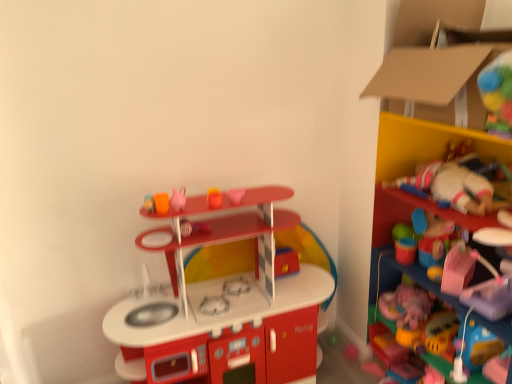
Question: Is cardboard at upper right bigger than matte pink teapot at upper center, positioned as the fifth toy in bottom-to-top order?

Choices:
 (A) no
 (B) yes

Answer: (B)

Question: Considering the relative sizes of cardboard at upper right and matte pink teapot at upper center, positioned as the fifth toy in bottom-to-top order, in the image provided, is cardboard at upper right wider than matte pink teapot at upper center, positioned as the fifth toy in bottom-to-top order,?

Choices:
 (A) no
 (B) yes

Answer: (B)

Question: Are cardboard at upper right and matte pink teapot at upper center, arranged as the 2th toy when viewed from the top, far apart?

Choices:
 (A) yes
 (B) no

Answer: (A)

Question: Is cardboard at upper right smaller than matte pink teapot at upper center, positioned as the fifth toy in bottom-to-top order?

Choices:
 (A) no
 (B) yes

Answer: (A)

Question: Is cardboard at upper right next to matte pink teapot at upper center, arranged as the 2th toy when viewed from the top?

Choices:
 (A) yes
 (B) no

Answer: (B)

Question: From the image's perspective, is plush fabric stuffed animal at right, which is the first shelf in top-to-bottom order, located above or below smooth plastic cup at upper center, which is the 4th toy in bottom-to-top order?

Choices:
 (A) above
 (B) below

Answer: (B)

Question: Considering the positions of plush fabric stuffed animal at right, marked as the 2th shelf in a bottom-to-top arrangement, and smooth plastic cup at upper center, marked as the third toy in a top-to-bottom arrangement, in the image, is plush fabric stuffed animal at right, marked as the 2th shelf in a bottom-to-top arrangement, bigger or smaller than smooth plastic cup at upper center, marked as the third toy in a top-to-bottom arrangement,?

Choices:
 (A) big
 (B) small

Answer: (A)

Question: From a real-world perspective, is plush fabric stuffed animal at right, which is the first shelf in top-to-bottom order, positioned above or below smooth plastic cup at upper center, marked as the third toy in a top-to-bottom arrangement?

Choices:
 (A) below
 (B) above

Answer: (A)

Question: Considering their positions, is plush fabric stuffed animal at right, marked as the 2th shelf in a bottom-to-top arrangement, located in front of or behind smooth plastic cup at upper center, which is the 4th toy in bottom-to-top order?

Choices:
 (A) behind
 (B) front

Answer: (B)

Question: Is pink matte heart at upper center, the 6th toy ordered from the bottom, in front of or behind matte plastic cup at center, which ranks as the 4th toy in top-to-bottom order, in the image?

Choices:
 (A) behind
 (B) front

Answer: (B)

Question: Based on their sizes in the image, would you say pink matte heart at upper center, the 6th toy ordered from the bottom, is bigger or smaller than matte plastic cup at center, the third toy from the bottom?

Choices:
 (A) small
 (B) big

Answer: (A)

Question: Does point (244, 188) appear closer or farther from the camera than point (181, 230)?

Choices:
 (A) closer
 (B) farther

Answer: (B)

Question: From a real-world perspective, relative to matte plastic cup at center, which ranks as the 4th toy in top-to-bottom order, is pink matte heart at upper center, the 6th toy ordered from the bottom, vertically above or below?

Choices:
 (A) below
 (B) above

Answer: (B)

Question: From a real-world perspective, is matte plastic toy kitchen at center, the sixth toy in the top-to-bottom sequence, positioned above or below matte plastic cup at center, the third toy from the bottom?

Choices:
 (A) below
 (B) above

Answer: (A)

Question: Considering the relative positions of matte plastic toy kitchen at center, the sixth toy in the top-to-bottom sequence, and matte plastic cup at center, the third toy from the bottom, in the image provided, is matte plastic toy kitchen at center, the sixth toy in the top-to-bottom sequence, to the left or to the right of matte plastic cup at center, the third toy from the bottom,?

Choices:
 (A) right
 (B) left

Answer: (A)